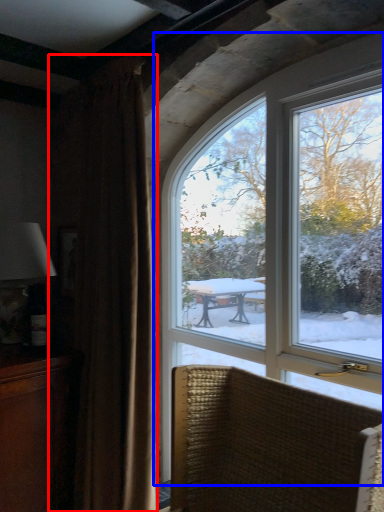
Question: Which of the following is the farthest to the observer, curtain (highlighted by a red box) or window (highlighted by a blue box)?

Choices:
 (A) curtain
 (B) window

Answer: (A)